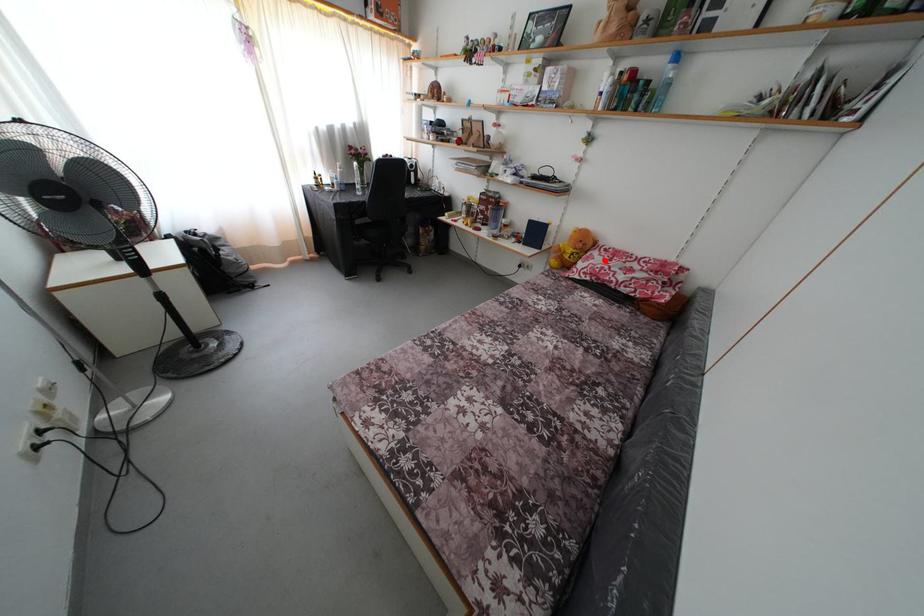
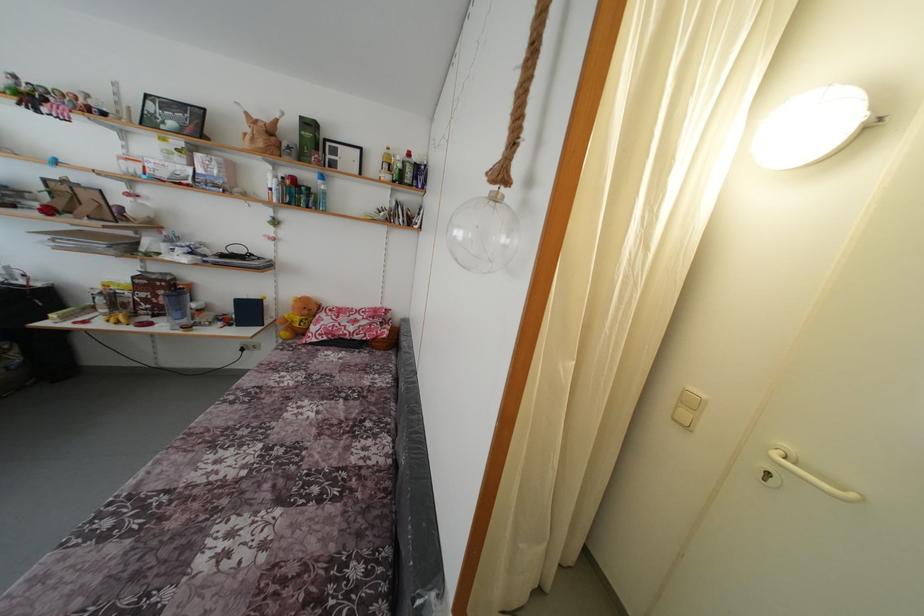
Locate, in the second image, the point that corresponds to the highlighted location in the first image.

(332, 321)